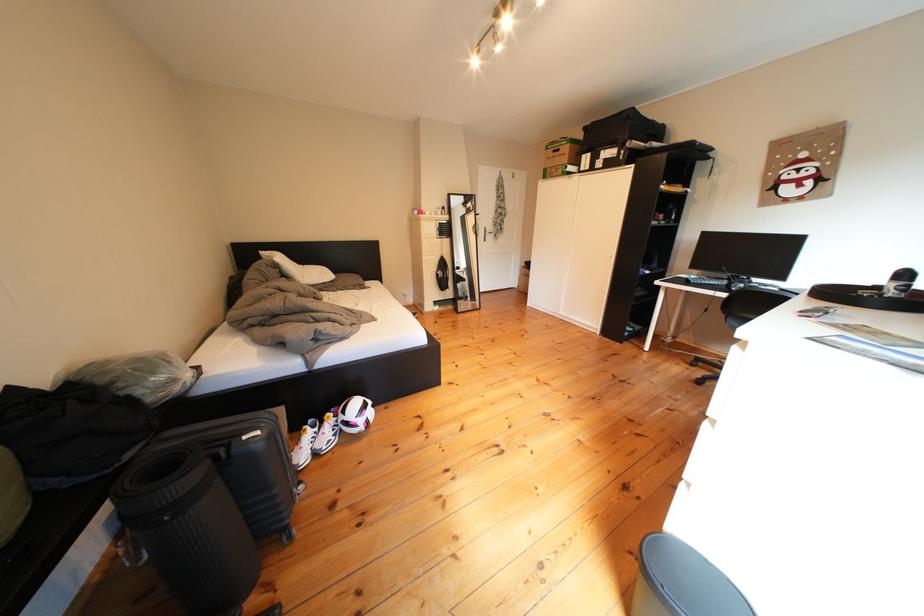
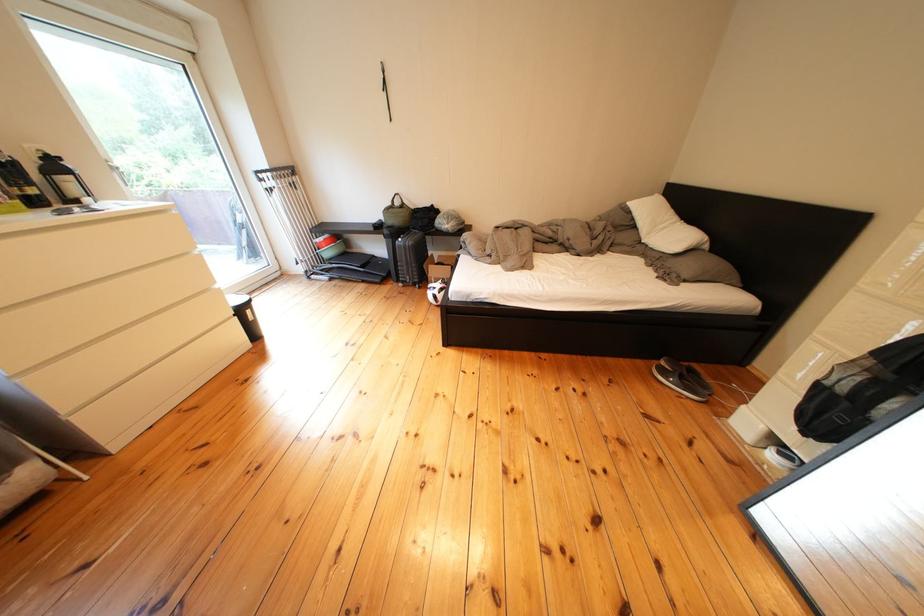
The point at (298, 281) is marked in the first image. Where is the corresponding point in the second image?

(649, 230)